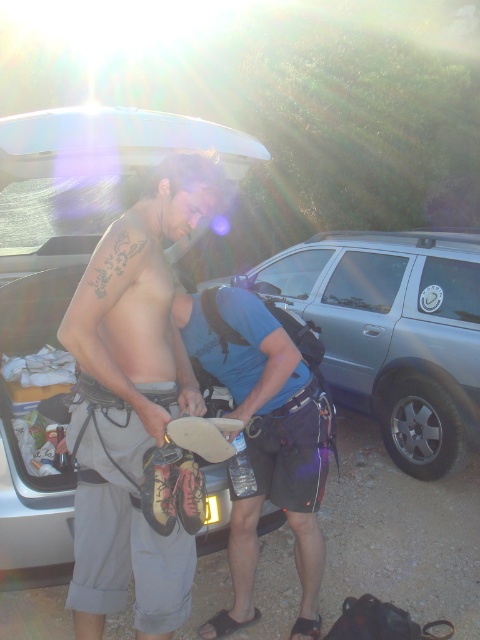
Question: Where is gray fabric shorts at center located in relation to blue fabric shirt at center in the image?

Choices:
 (A) above
 (B) below

Answer: (A)

Question: Which is nearer to the blue fabric shirt at center?

Choices:
 (A) gray fabric shorts at center
 (B) metallic silver minivan at center

Answer: (A)

Question: Which of the following is the farthest from the observer?

Choices:
 (A) (205, 316)
 (B) (92, 276)
 (C) (316, 620)
 (D) (322, 288)

Answer: (D)

Question: In this image, where is gray fabric shorts at center located relative to blue fabric shirt at center?

Choices:
 (A) right
 (B) left

Answer: (B)

Question: Which object appears closest to the camera in this image?

Choices:
 (A) gray fabric shorts at center
 (B) metallic silver minivan at center
 (C) blue fabric shirt at center

Answer: (A)

Question: Observing the image, what is the correct spatial positioning of gray fabric shorts at center in reference to blue fabric shirt at center?

Choices:
 (A) below
 (B) above

Answer: (B)